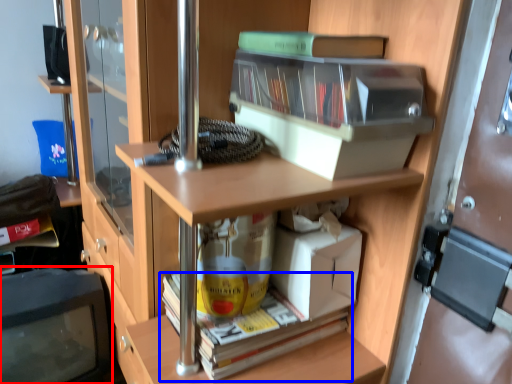
Question: Which point is further to the camera, computer monitor (highlighted by a red box) or book (highlighted by a blue box)?

Choices:
 (A) computer monitor
 (B) book

Answer: (A)